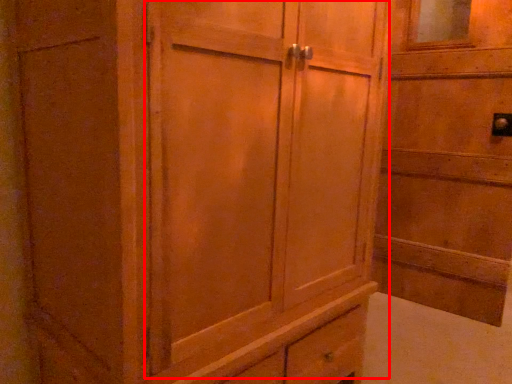
Question: From the image's perspective, where is barn door (annotated by the red box) located relative to elevator?

Choices:
 (A) below
 (B) above

Answer: (A)